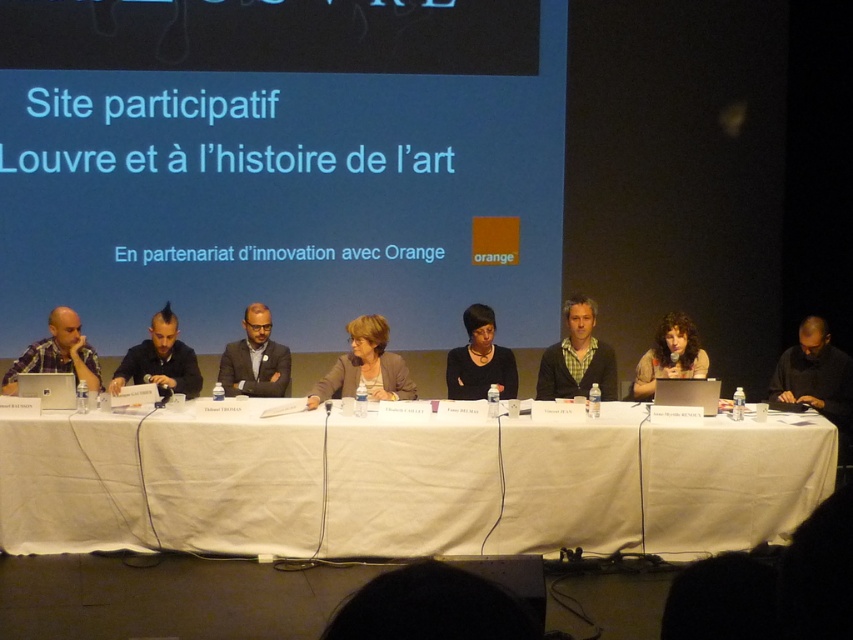
Question: Does white fabric table at center appear under matte black hat at center?

Choices:
 (A) no
 (B) yes

Answer: (B)

Question: Which of the following is the closest to the observer?

Choices:
 (A) checkered fabric shirt at center
 (B) matte black hat at center
 (C) black matte shirt at center

Answer: (B)

Question: Is white fabric table at center closer to camera compared to matte purple shirt at left?

Choices:
 (A) yes
 (B) no

Answer: (A)

Question: In this image, where is white fabric table at center located relative to matte black hat at center?

Choices:
 (A) right
 (B) left

Answer: (B)

Question: Among these points, which one is farthest from the camera?

Choices:
 (A) (85, 342)
 (B) (567, 364)
 (C) (164, 496)

Answer: (B)

Question: Which of the following is the farthest from the observer?

Choices:
 (A) (639, 376)
 (B) (248, 353)
 (C) (807, 372)
 (D) (3, 381)

Answer: (C)